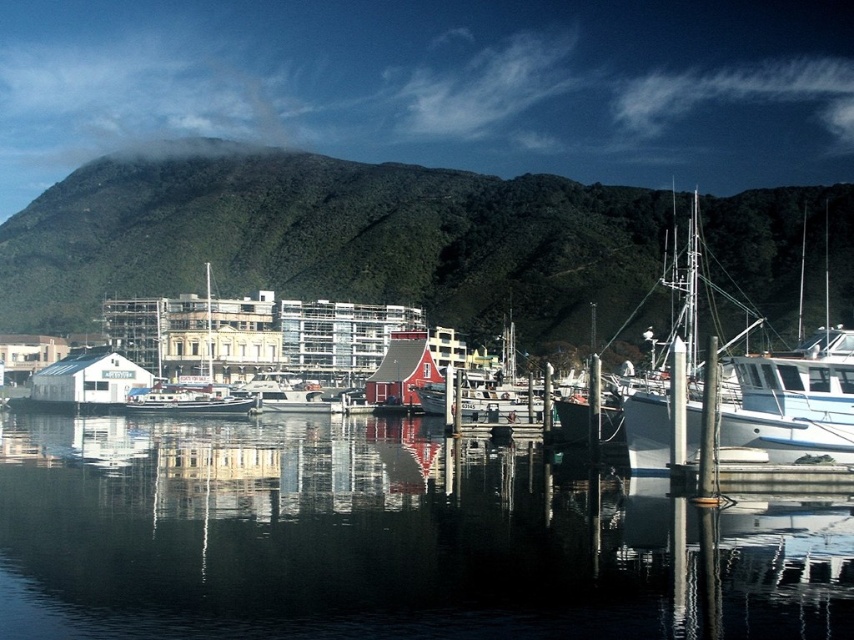
Does transparent water at center have a lesser height compared to green forested mountain at upper center?

Yes, transparent water at center is shorter than green forested mountain at upper center.

Does transparent water at center appear under green forested mountain at upper center?

Yes.

Who is more forward, (724, 627) or (101, 161)?

Positioned in front is point (724, 627).

Locate an element on the screen. The width and height of the screenshot is (854, 640). transparent water at center is located at coordinates (373, 540).

Does point (449, 240) come closer to viewer compared to point (208, 397)?

No, (449, 240) is behind (208, 397).

Is green forested mountain at upper center smaller than white wooden building at center?

No, green forested mountain at upper center is not smaller than white wooden building at center.

Measure the distance between point (486,268) and camera.

638.61 feet

Find the location of `green forested mountain at upper center`. green forested mountain at upper center is located at coordinates (331, 237).

Does white wooden building at center have a larger size compared to white glossy boat at center?

Indeed, white wooden building at center has a larger size compared to white glossy boat at center.

Which is below, white wooden building at center or white glossy boat at center?

white glossy boat at center

Between point (132, 397) and point (218, 408), which one is positioned in front?

Point (218, 408) is in front.

Where is `white wooden building at center`? This screenshot has width=854, height=640. white wooden building at center is located at coordinates (192, 387).